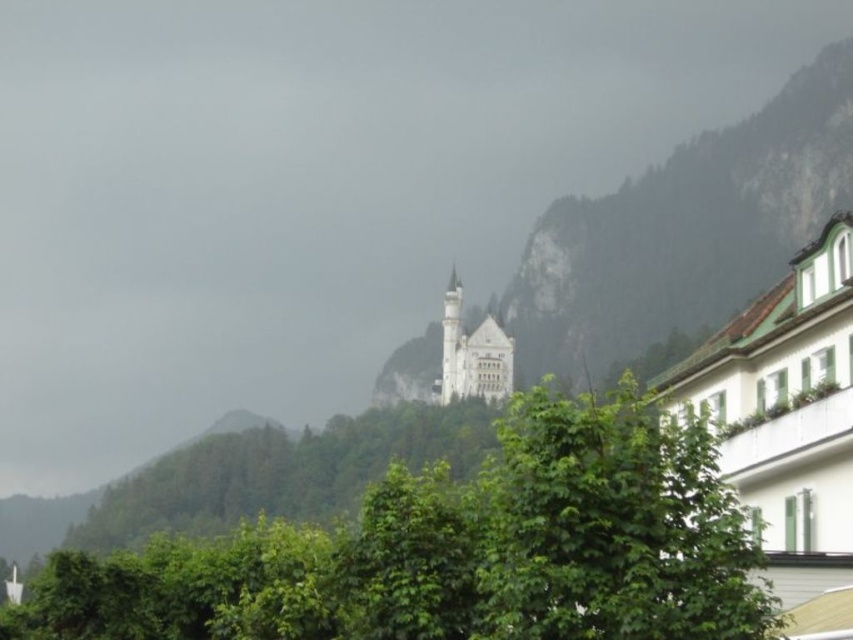
Question: Among these points, which one is nearest to the camera?

Choices:
 (A) (421, 529)
 (B) (753, 241)

Answer: (A)

Question: Is green leafy tree at center positioned before white stone castle at center?

Choices:
 (A) yes
 (B) no

Answer: (A)

Question: Can you confirm if green leafy tree at center is thinner than white stone castle at center?

Choices:
 (A) no
 (B) yes

Answer: (B)

Question: Is green leafy tree at center behind white stone castle at center?

Choices:
 (A) no
 (B) yes

Answer: (A)

Question: Which point is closer to the camera?

Choices:
 (A) (560, 573)
 (B) (751, 122)

Answer: (A)